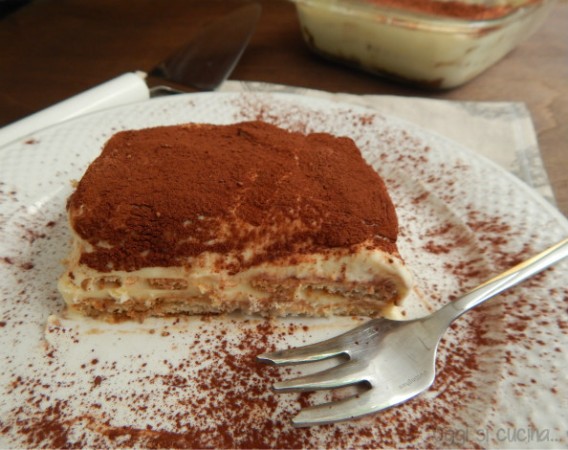
Locate an element on the screen. The width and height of the screenshot is (568, 450). napkin is located at coordinates (495, 133).